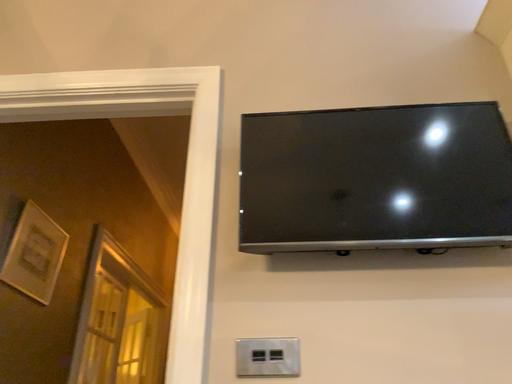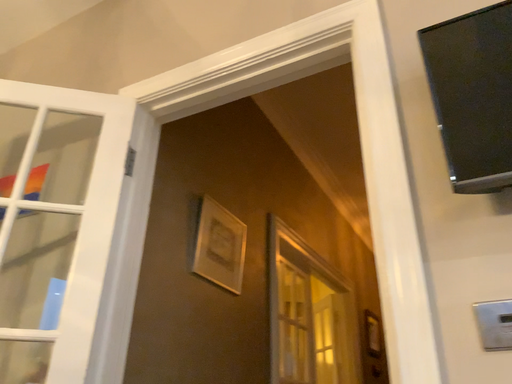
Question: Which way did the camera rotate in the video?

Choices:
 (A) rotated left
 (B) rotated right

Answer: (A)